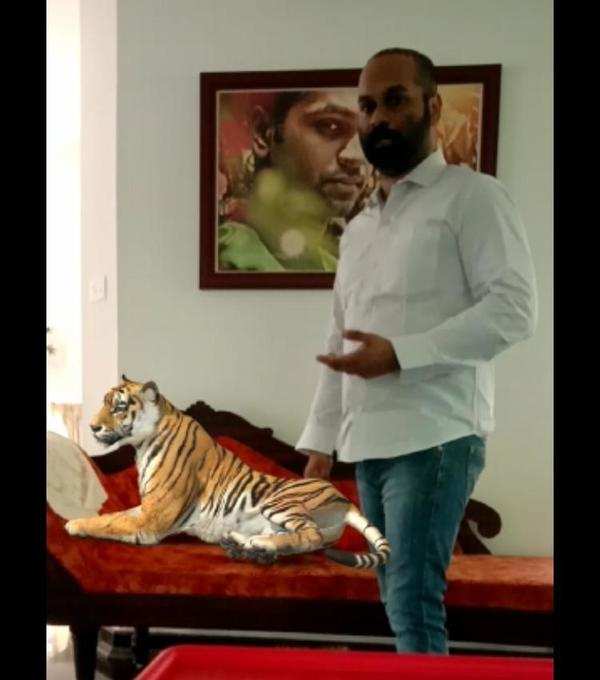
At what (x,y) coordinates should I click in order to perform the action: click on tiny rectangle on wall. Please return your answer as a coordinate pair (x, y). Image resolution: width=600 pixels, height=680 pixels. Looking at the image, I should click on (96, 290).